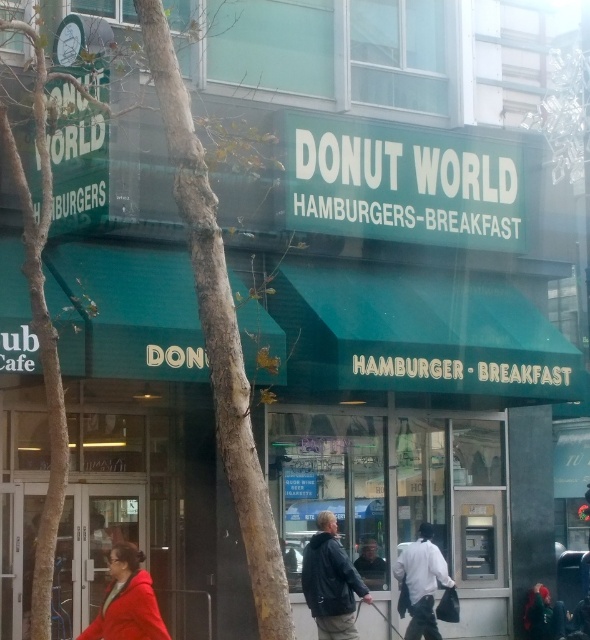
Question: Which of the following is the closest to the observer?

Choices:
 (A) (363, 547)
 (B) (336, 540)
 (C) (432, 529)
 (D) (93, 627)

Answer: (D)

Question: Is matte red coat at lower left further to camera compared to dark gray jacket at center?

Choices:
 (A) no
 (B) yes

Answer: (A)

Question: Which object appears closest to the camera in this image?

Choices:
 (A) leather jacket at center
 (B) white matte jacket at center

Answer: (A)

Question: Which object appears closest to the camera in this image?

Choices:
 (A) matte red coat at lower left
 (B) dark gray jacket at center

Answer: (A)

Question: Can you confirm if matte red coat at lower left is smaller than white matte jacket at center?

Choices:
 (A) no
 (B) yes

Answer: (B)

Question: Is leather jacket at center to the right of white matte jacket at center from the viewer's perspective?

Choices:
 (A) no
 (B) yes

Answer: (A)